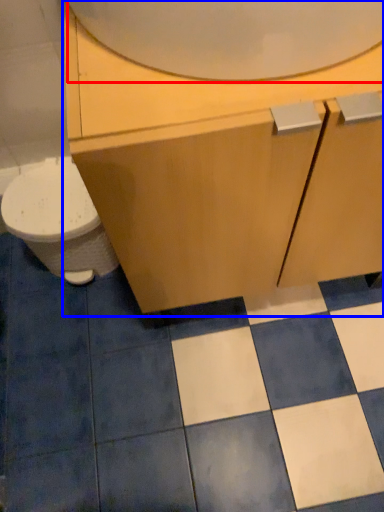
Question: Which of the following is the farthest to the observer, mirror (highlighted by a red box) or bathroom cabinet (highlighted by a blue box)?

Choices:
 (A) mirror
 (B) bathroom cabinet

Answer: (B)